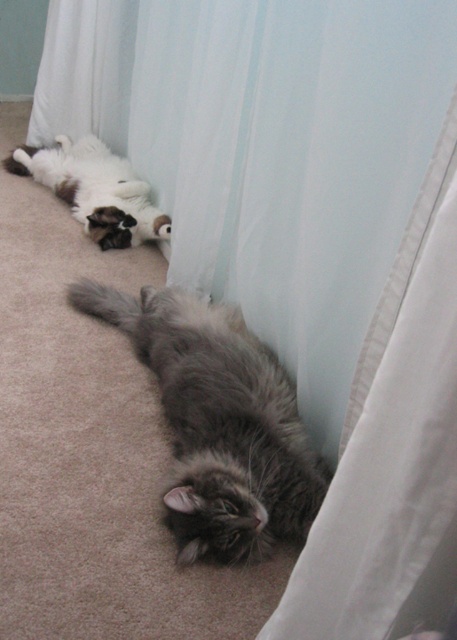
Question: Can you confirm if gray tabby cat at center is thinner than fluffy white cat at upper left?

Choices:
 (A) yes
 (B) no

Answer: (A)

Question: Is gray tabby cat at center to the left of fluffy white cat at upper left from the viewer's perspective?

Choices:
 (A) no
 (B) yes

Answer: (A)

Question: Can you confirm if gray tabby cat at center is positioned below fluffy white cat at upper left?

Choices:
 (A) no
 (B) yes

Answer: (B)

Question: Which point is closer to the camera taking this photo?

Choices:
 (A) (258, 490)
 (B) (111, 193)

Answer: (A)